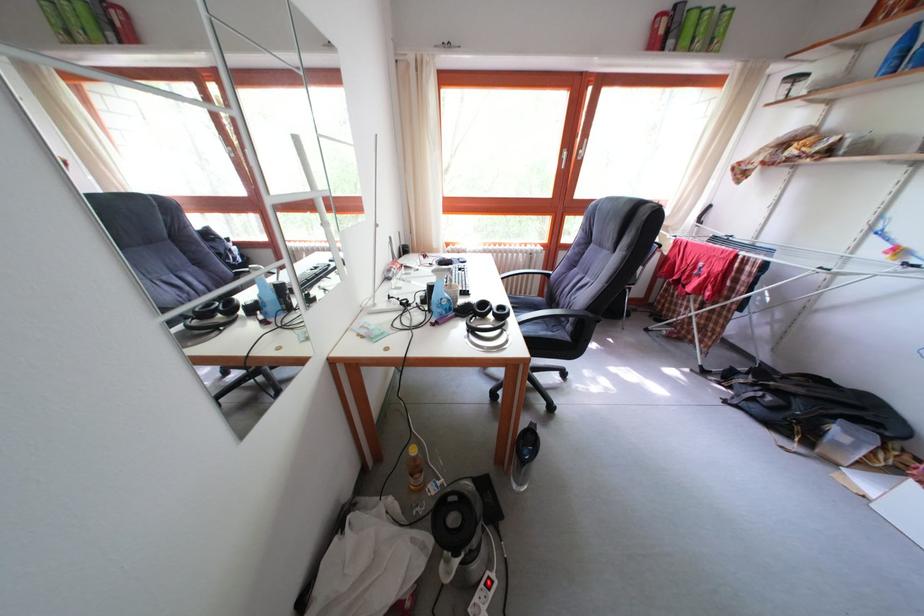
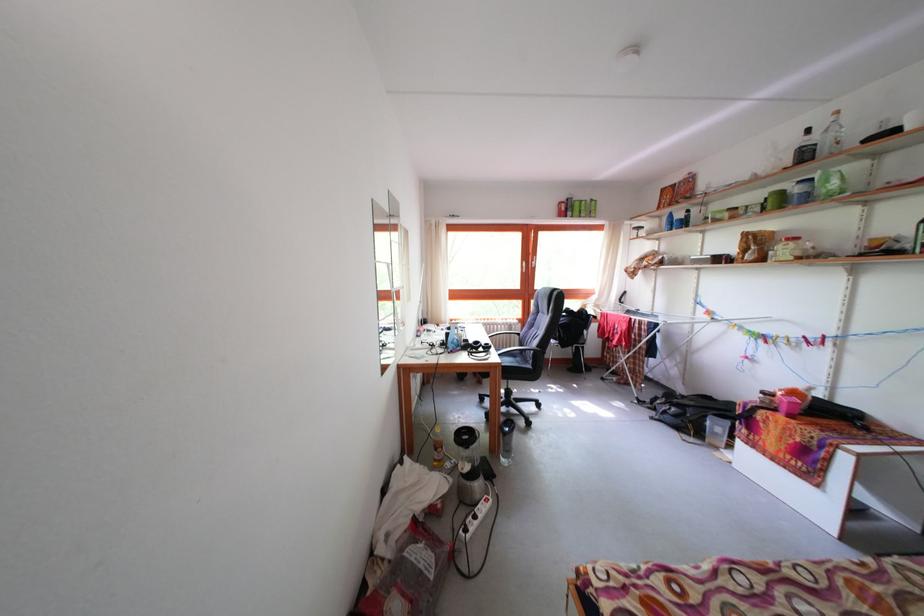
The point at (868, 54) is marked in the first image. Where is the corresponding point in the second image?

(667, 224)